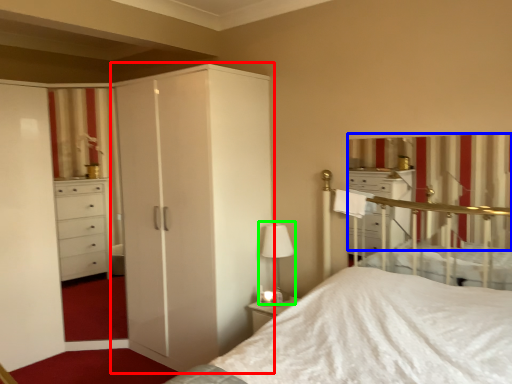
Question: Which is farther away from cupboard (highlighted by a red box)? curtain (highlighted by a blue box) or table lamp (highlighted by a green box)?

Choices:
 (A) curtain
 (B) table lamp

Answer: (A)